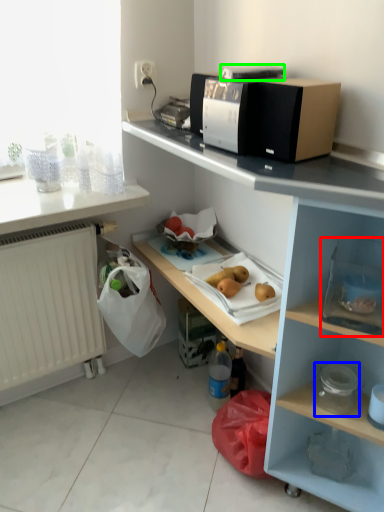
Question: Estimate the real-world distances between objects in this image. Which object is closer to box (highlighted by a red box), appliance (highlighted by a blue box) or appliance (highlighted by a green box)?

Choices:
 (A) appliance
 (B) appliance

Answer: (A)